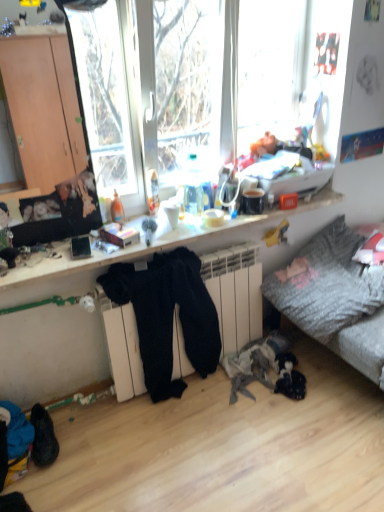
At what (x,y) coordinates should I click in order to perform the action: click on wooden desk at center. Please return your answer as a coordinate pair (x, y). Looking at the image, I should click on (228, 222).

The image size is (384, 512). Describe the element at coordinates (228, 222) in the screenshot. I see `wooden desk at center` at that location.

Where is `black suede shoes at lower left`? Image resolution: width=384 pixels, height=512 pixels. black suede shoes at lower left is located at coordinates pyautogui.click(x=43, y=437).

The image size is (384, 512). I want to click on footwear to the left of wooden desk at center, so click(x=43, y=437).

Which is more to the left, wooden desk at center or black suede shoes at lower left?

Positioned to the left is black suede shoes at lower left.

Is wooden desk at center oriented away from black suede shoes at lower left?

No, wooden desk at center is not facing away from black suede shoes at lower left.

Considering the sizes of black suede shoes at lower left and wooden desk at center in the image, is black suede shoes at lower left wider or thinner than wooden desk at center?

Clearly, black suede shoes at lower left has less width compared to wooden desk at center.

From the image's perspective, is black suede shoes at lower left on wooden desk at center?

No, from the image's perspective, black suede shoes at lower left is not above wooden desk at center.

From a real-world perspective, who is located lower, black suede shoes at lower left or wooden desk at center?

black suede shoes at lower left, from a real-world perspective.

Is black fuzzy pants at center turned away from wooden desk at center?

Yes.

Considering the positions of objects black fuzzy pants at center and wooden desk at center in the image provided, who is more to the left, black fuzzy pants at center or wooden desk at center?

black fuzzy pants at center.

Can you confirm if black fuzzy pants at center is thinner than wooden desk at center?

Yes.

From a real-world perspective, is black fuzzy pants at center above or below wooden desk at center?

From a real-world perspective, black fuzzy pants at center is physically below wooden desk at center.

From the image's perspective, is textured gray fabric couch at lower right above or below black suede shoes at lower left?

textured gray fabric couch at lower right is above black suede shoes at lower left.

Who is taller, textured gray fabric couch at lower right or black suede shoes at lower left?

textured gray fabric couch at lower right.

Which object is wider, textured gray fabric couch at lower right or black suede shoes at lower left?

textured gray fabric couch at lower right is wider.

From a real-world perspective, which is physically above, textured gray fabric couch at lower right or black suede shoes at lower left?

textured gray fabric couch at lower right, from a real-world perspective.

From the image's perspective, does black suede shoes at lower left appear lower than textured gray fabric couch at lower right?

Indeed, from the image's perspective, black suede shoes at lower left is shown beneath textured gray fabric couch at lower right.

Which is behind, point (34, 460) or point (379, 338)?

Point (379, 338)

Looking at this image, can you confirm if black suede shoes at lower left is thinner than textured gray fabric couch at lower right?

Yes, black suede shoes at lower left is thinner than textured gray fabric couch at lower right.

Is wooden desk at center facing away from textured gray fabric couch at lower right?

No, textured gray fabric couch at lower right is not at the back of wooden desk at center.

Between point (339, 201) and point (364, 277), which one is positioned in front?

The point (364, 277) is more forward.

Considering the sizes of wooden desk at center and textured gray fabric couch at lower right in the image, is wooden desk at center bigger or smaller than textured gray fabric couch at lower right?

In the image, wooden desk at center appears to be smaller than textured gray fabric couch at lower right.

From the image's perspective, is wooden desk at center located above textured gray fabric couch at lower right?

Yes, from the image's perspective, wooden desk at center is on top of textured gray fabric couch at lower right.

From the image's perspective, is textured gray fabric couch at lower right located above or below wooden desk at center?

Clearly, from the image's perspective, textured gray fabric couch at lower right is below wooden desk at center.

Considering the sizes of objects textured gray fabric couch at lower right and wooden desk at center in the image provided, who is thinner, textured gray fabric couch at lower right or wooden desk at center?

wooden desk at center.

Does textured gray fabric couch at lower right have a smaller size compared to wooden desk at center?

No.

Can you tell me how much textured gray fabric couch at lower right and wooden desk at center differ in facing direction?

The facing directions of textured gray fabric couch at lower right and wooden desk at center are 4.95 degrees apart.

Where is `desk above the black suede shoes at lower left (from a real-world perspective)`? The image size is (384, 512). desk above the black suede shoes at lower left (from a real-world perspective) is located at coordinates [228, 222].

The image size is (384, 512). Find the location of `footwear on the left side of wooden desk at center`. footwear on the left side of wooden desk at center is located at coordinates (43, 437).

When comparing their distances from black fuzzy pants at center, does textured gray fabric couch at lower right or black suede shoes at lower left seem closer?

textured gray fabric couch at lower right is positioned closer to the anchor black fuzzy pants at center.

Based on their spatial positions, is textured gray fabric couch at lower right or black suede shoes at lower left further from wooden desk at center?

The object further to wooden desk at center is black suede shoes at lower left.

Looking at this image, which object lies nearer to the anchor point textured gray fabric couch at lower right, wooden desk at center or black suede shoes at lower left?

Based on the image, wooden desk at center appears to be nearer to textured gray fabric couch at lower right.

Which object lies further to the anchor point black suede shoes at lower left, textured gray fabric couch at lower right or wooden desk at center?

textured gray fabric couch at lower right is further to black suede shoes at lower left.

Which object lies nearer to the anchor point black fuzzy pants at center, textured gray fabric couch at lower right or wooden desk at center?

wooden desk at center.

Estimate the real-world distances between objects in this image. Which object is further from wooden desk at center, textured gray fabric couch at lower right or black fuzzy pants at center?

textured gray fabric couch at lower right is further to wooden desk at center.

Estimate the real-world distances between objects in this image. Which object is further from textured gray fabric couch at lower right, black suede shoes at lower left or wooden desk at center?

black suede shoes at lower left is positioned further to the anchor textured gray fabric couch at lower right.

Estimate the real-world distances between objects in this image. Which object is closer to wooden desk at center, black fuzzy pants at center or black suede shoes at lower left?

black fuzzy pants at center.

Locate an element on the screen. The width and height of the screenshot is (384, 512). clothing between black suede shoes at lower left and textured gray fabric couch at lower right in the horizontal direction is located at coordinates (167, 316).

Where is `clothing between wooden desk at center and black suede shoes at lower left in the up-down direction`? This screenshot has height=512, width=384. clothing between wooden desk at center and black suede shoes at lower left in the up-down direction is located at coordinates (167, 316).

Locate an element on the screen. Image resolution: width=384 pixels, height=512 pixels. desk between black fuzzy pants at center and textured gray fabric couch at lower right from left to right is located at coordinates (228, 222).

Locate an element on the screen. desk between black suede shoes at lower left and textured gray fabric couch at lower right is located at coordinates (228, 222).